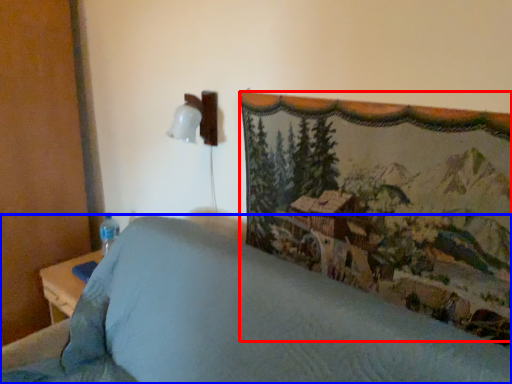
Question: Which object appears farthest to the camera in this image, mountain landscape (highlighted by a red box) or furniture (highlighted by a blue box)?

Choices:
 (A) mountain landscape
 (B) furniture

Answer: (A)